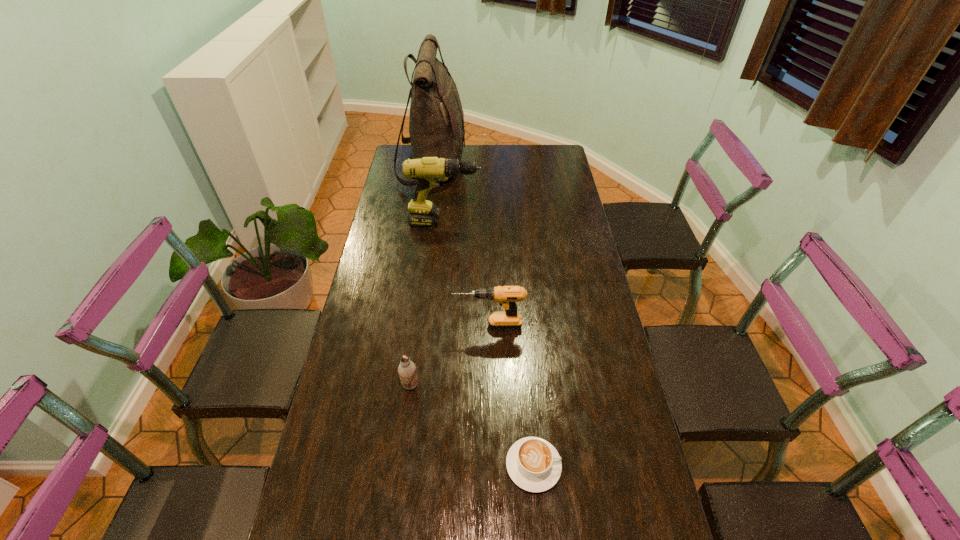
Select which drill appears as the closest to the nearest object. Please provide its 2D coordinates. Your answer should be formatted as a tuple, i.e. [(x, y)], where the tuple contains the x and y coordinates of a point satisfying the conditions above.

[(507, 296)]

Choose which drill is the nearest neighbor to the cappuccino. Please provide its 2D coordinates. Your answer should be formatted as a tuple, i.e. [(x, y)], where the tuple contains the x and y coordinates of a point satisfying the conditions above.

[(507, 296)]